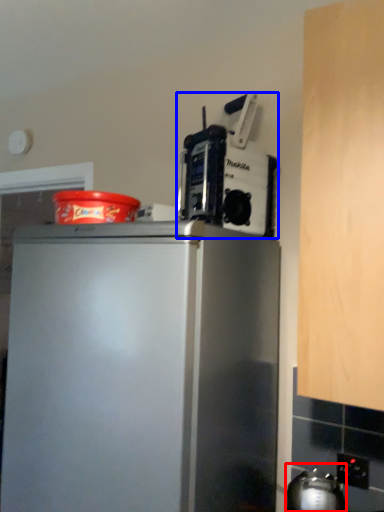
Question: Which of the following is the closest to the observer, appliance (highlighted by a red box) or kitchen appliance (highlighted by a blue box)?

Choices:
 (A) appliance
 (B) kitchen appliance

Answer: (A)